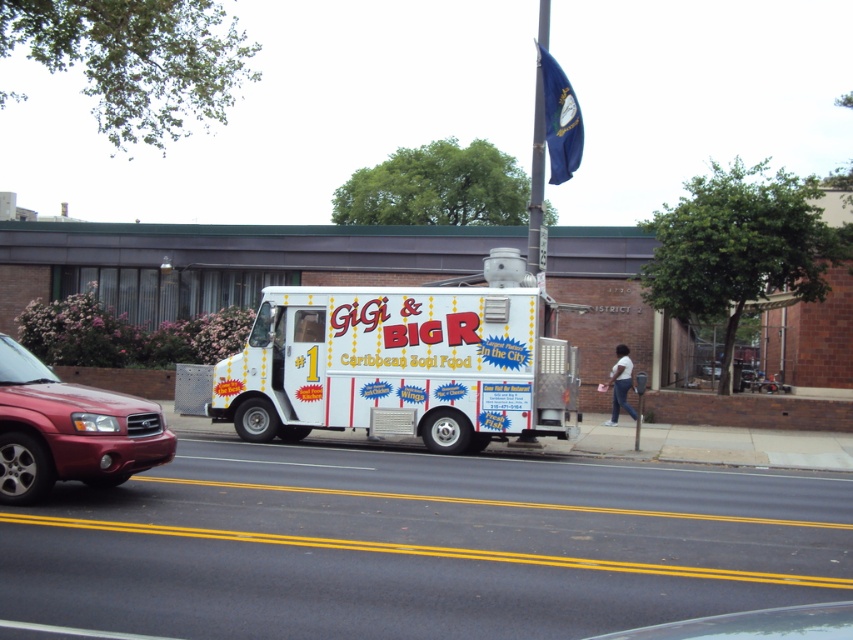
You are standing at the center of the road and want to walk to the food truck. Which direction should you go to avoid the metallic red suv at left?

The metallic red suv at left is located at point (68, 429), so you should walk towards the right side of the road to avoid it and reach the food truck safely.

You are standing on the sidewalk next to the GiGi and BIG R food truck. You want to find the exact location of the point at coordinate (402, 364). Where would you look on the food truck?

The point at coordinate (402, 364) is located on the white glossy food truck at center.

You are a delivery person who needs to park your motorcycle between the metallic red suv at left and the metallic pole at upper center. Can your motorcycle fit in the space between them?

The metallic red suv at left has a lesser width compared to metallic pole at upper center. Since the suv is narrower than the pole, the space between them might be sufficient for the motorcycle, but the exact width isnecessary to determine if it fits. However, based on the given information, we cannot confirm the available space between the two objects.